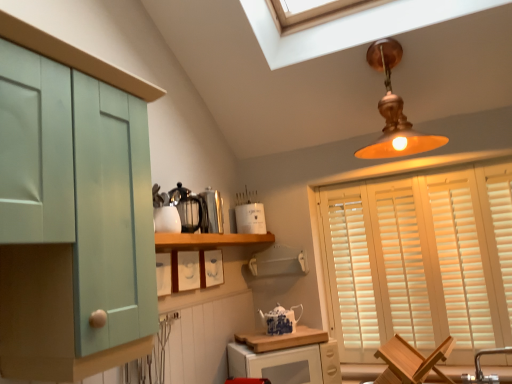
Find the location of `free point above white wooden blinds at right (from a real-world perspective)`. free point above white wooden blinds at right (from a real-world perspective) is located at coordinates (420, 172).